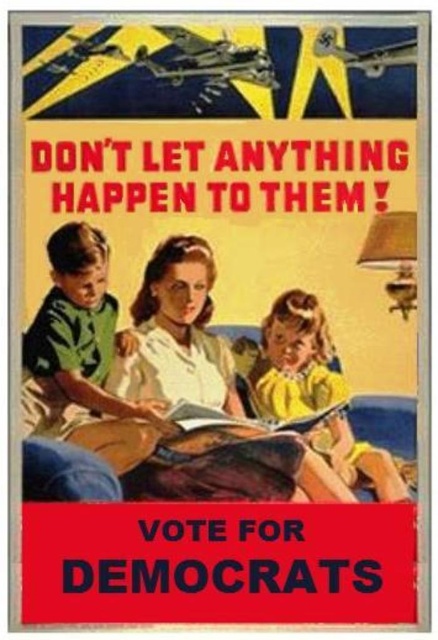
In the vintage political poster described, there is a yellow matte dress at lower right and a hardcover book at center. From the perspective of someone looking at the poster, which object appears closer to the viewer?

The yellow matte dress at lower right appears closer to the viewer because it is positioned in front of the hardcover book at center.

You are a graphic designer reviewing the vintage political poster. The poster has a green matte shirt at left and a hardcover book at center. Which object in the poster takes up more visual space?

The green matte shirt at left takes up more visual space because it is bigger than the hardcover book at center.

You are a graphic designer reviewing the vintage political poster. You need to determine which of the two points, point (62,372) or point (225,413), is closer to the viewer. Based on the poster layout, which point is nearer?

Point (62,372) is closer to the camera than point (225,413).